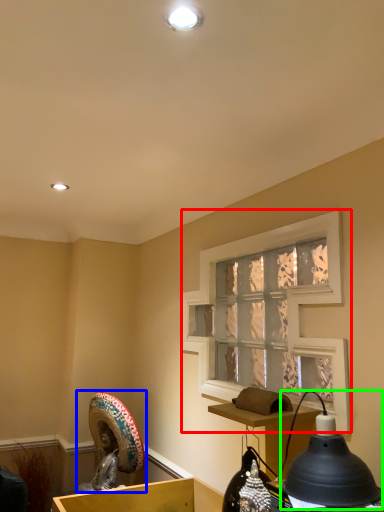
Question: Which object is positioned closest to window screen (highlighted by a red box)? Select from sculpture (highlighted by a blue box) and lamp (highlighted by a green box).

Choices:
 (A) sculpture
 (B) lamp

Answer: (B)